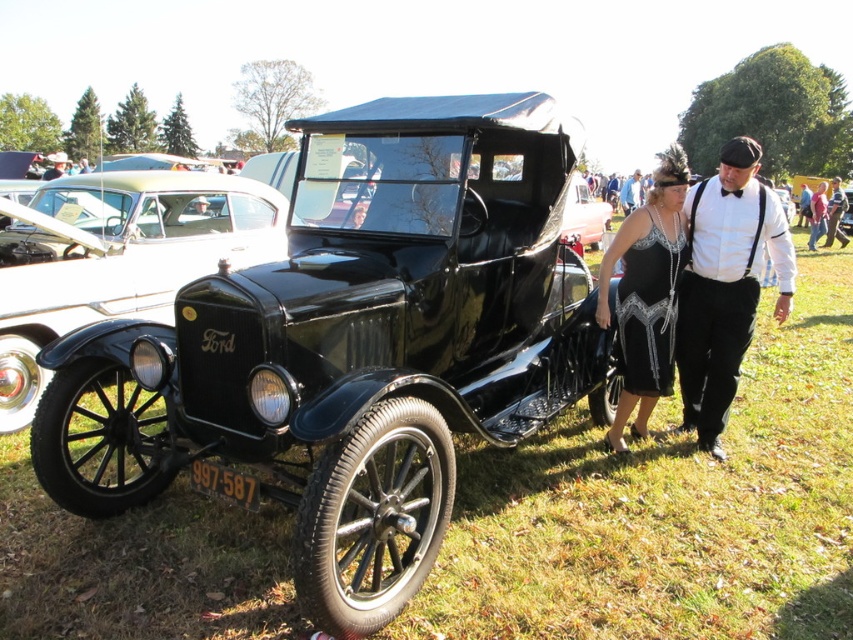
Does shiny black ford at center come behind black leather jacket at center?

That is False.

This screenshot has height=640, width=853. Identify the location of shiny black ford at center. (115, 259).

This screenshot has width=853, height=640. Describe the element at coordinates (115, 259) in the screenshot. I see `shiny black ford at center` at that location.

The width and height of the screenshot is (853, 640). I want to click on shiny black ford at center, so click(115, 259).

Is white cotton shirt at center smaller than black satin dress at center?

Yes, white cotton shirt at center is smaller than black satin dress at center.

What do you see at coordinates (724, 284) in the screenshot?
I see `white cotton shirt at center` at bounding box center [724, 284].

The width and height of the screenshot is (853, 640). In order to click on white cotton shirt at center in this screenshot , I will do click(x=724, y=284).

Is shiny black ford at center smaller than white cotton shirt at center?

No, shiny black ford at center is not smaller than white cotton shirt at center.

Does point (93, 243) come behind point (728, 208)?

Yes.

This screenshot has height=640, width=853. I want to click on shiny black ford at center, so click(x=115, y=259).

The image size is (853, 640). I want to click on shiny black ford at center, so click(x=115, y=259).